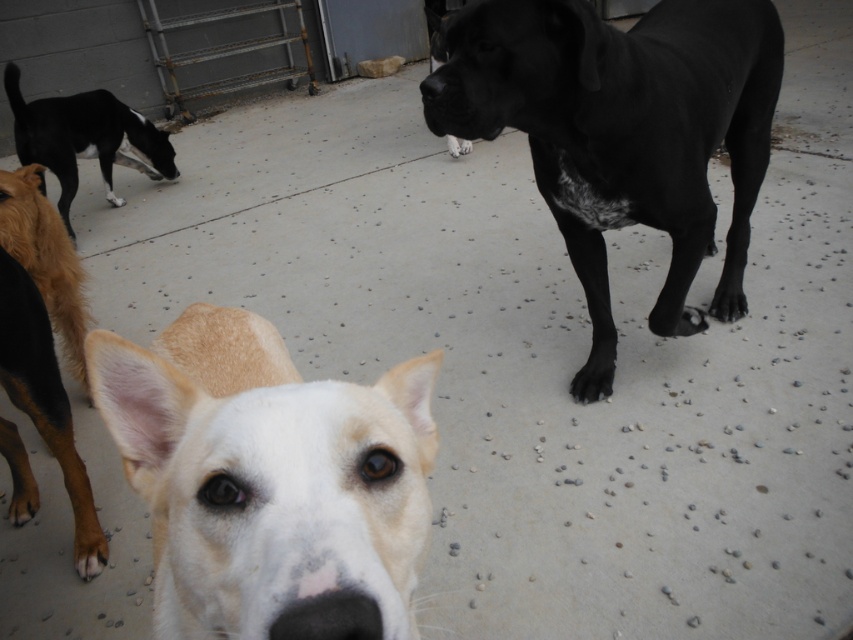
Question: Which object appears closest to the camera in this image?

Choices:
 (A) white fur dog at center
 (B) brown fur at lower left

Answer: (A)

Question: Is black smooth dog at upper right to the left of brown fur at lower left from the viewer's perspective?

Choices:
 (A) yes
 (B) no

Answer: (B)

Question: Is black smooth dog at upper right below black glossy dog at upper left?

Choices:
 (A) no
 (B) yes

Answer: (B)

Question: Which of the following is the farthest from the observer?

Choices:
 (A) black smooth dog at upper right
 (B) brown fur at lower left
 (C) black glossy dog at upper left

Answer: (C)

Question: Does black smooth dog at upper right appear over black glossy dog at upper left?

Choices:
 (A) yes
 (B) no

Answer: (B)

Question: Estimate the real-world distances between objects in this image. Which object is closer to the black glossy dog at upper left?

Choices:
 (A) white fur dog at center
 (B) black smooth dog at upper right
 (C) brown fur at lower left

Answer: (C)